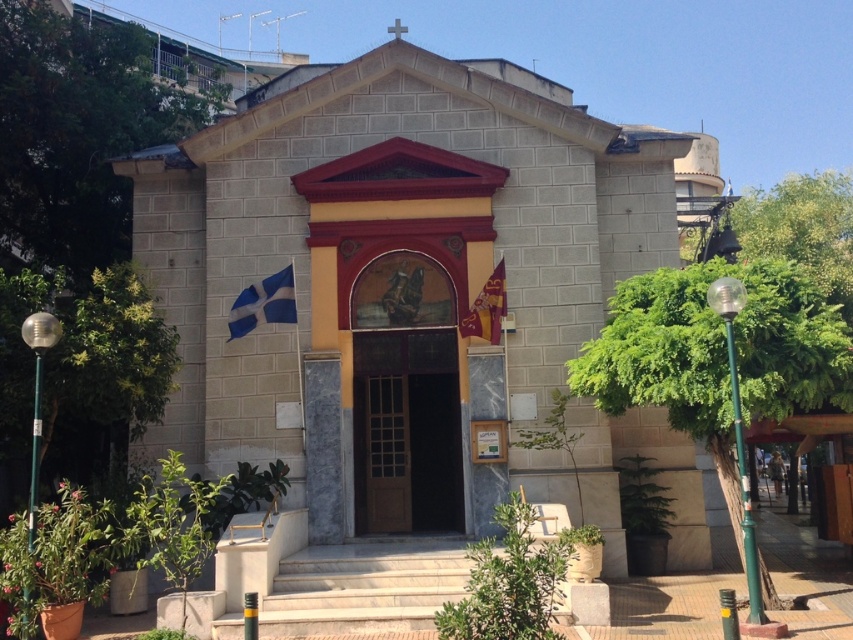
Question: Does green leafy tree at lower left appear on the right side of white marble stairs at center?

Choices:
 (A) yes
 (B) no

Answer: (B)

Question: Is gray stone chapel at center bigger than green leafy tree at right?

Choices:
 (A) no
 (B) yes

Answer: (B)

Question: Estimate the real-world distances between objects in this image. Which object is farther from the green leafy tree at upper left?

Choices:
 (A) green leafy tree at right
 (B) white marble stairs at center

Answer: (A)

Question: Among these points, which one is farthest from the camera?

Choices:
 (A) (55, 156)
 (B) (407, 412)

Answer: (A)

Question: Which point is closer to the camera taking this photo?

Choices:
 (A) (389, 336)
 (B) (770, 580)
 (C) (85, 465)

Answer: (B)

Question: Does green leafy tree at right appear under white marble stairs at center?

Choices:
 (A) yes
 (B) no

Answer: (B)